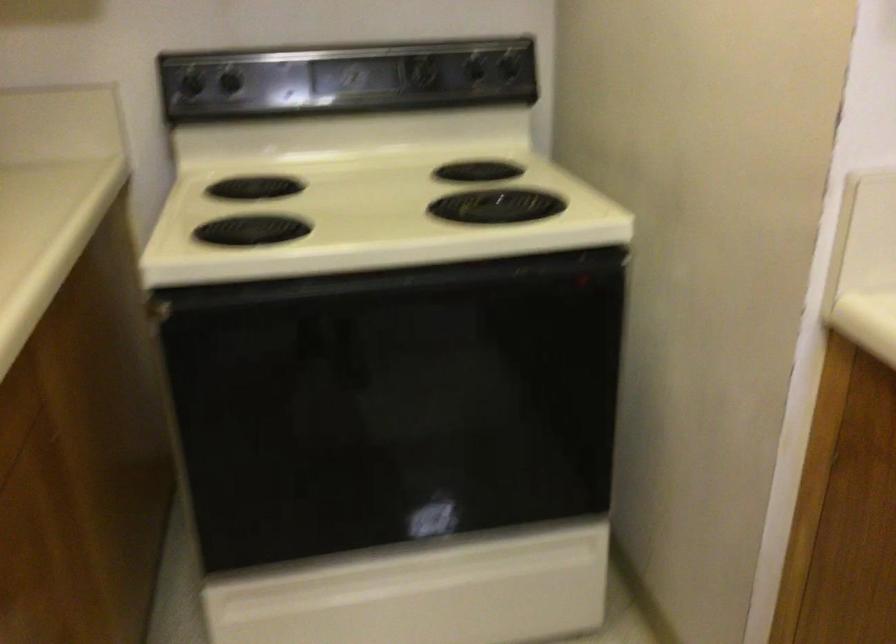
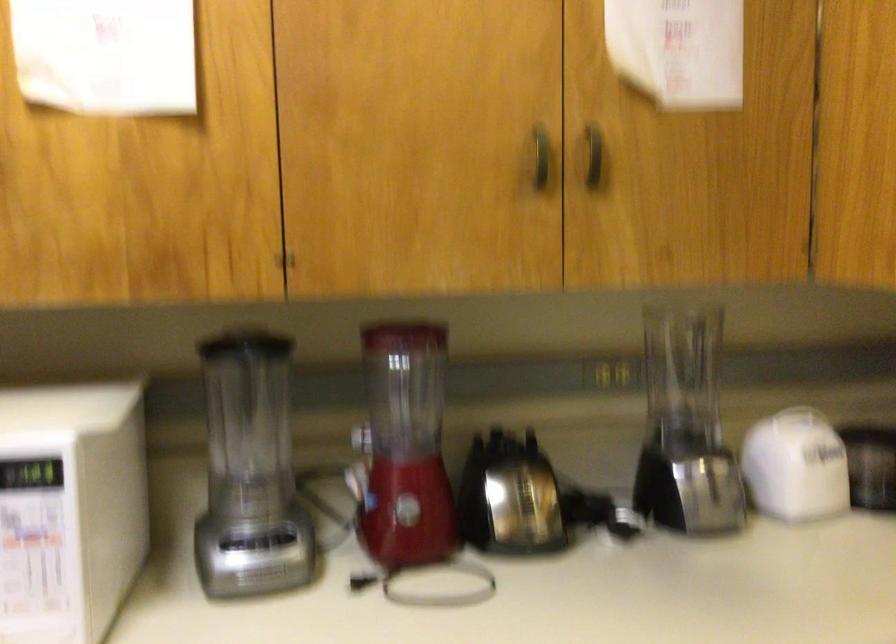
Question: The images are taken continuously from a first-person perspective. In which direction is your viewpoint rotating?

Choices:
 (A) Left
 (B) Right
 (C) Up
 (D) Down

Answer: (A)